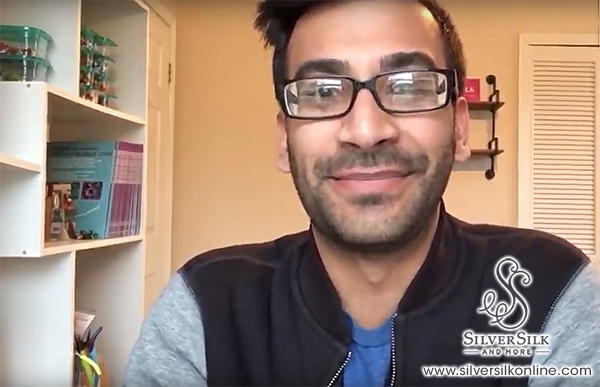
Where is `clear plastic containers`? clear plastic containers is located at coordinates (24, 69), (28, 39).